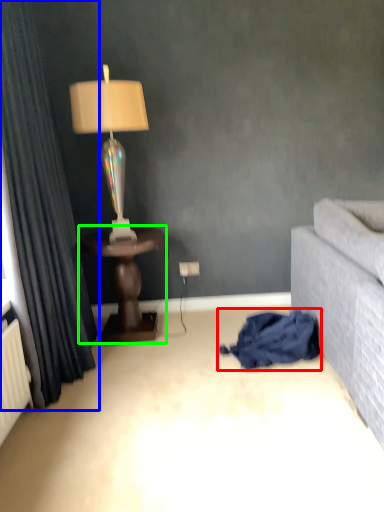
Question: Which object is the closest to the blanket (highlighted by a red box)? Choose among these: curtain (highlighted by a blue box) or table (highlighted by a green box).

Choices:
 (A) curtain
 (B) table

Answer: (B)